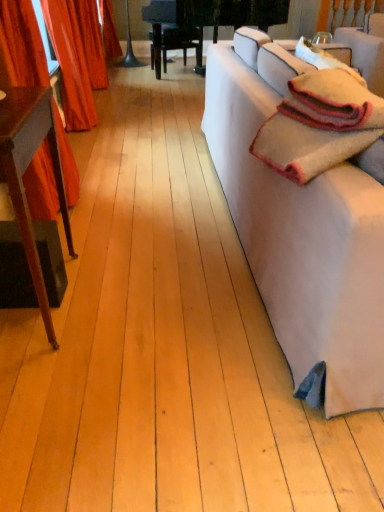
The image size is (384, 512). Identify the location of vacant space behind mahogany wood table at left. (101, 240).